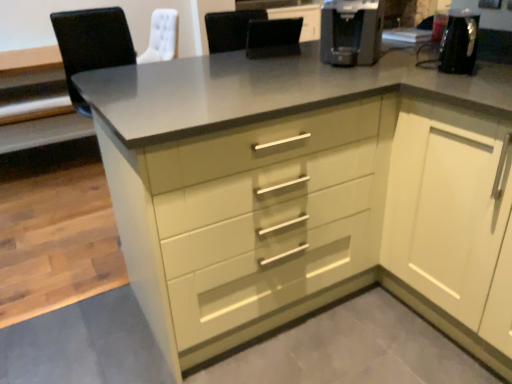
At what (x,y) coordinates should I click in order to perform the action: click on white glossy cabinet at right. Please return your answer as a coordinate pair (x, y). Looking at the image, I should click on pyautogui.click(x=453, y=214).

What do you see at coordinates (273, 38) in the screenshot?
I see `black leather chair at center` at bounding box center [273, 38].

Where is `black plastic coffee machine at upper right`? The width and height of the screenshot is (512, 384). black plastic coffee machine at upper right is located at coordinates (351, 32).

Is the surface of white glossy cabinet at right in direct contact with black leather chair at center?

No.

Considering the relative sizes of white glossy cabinet at right and black leather chair at center in the image provided, is white glossy cabinet at right thinner than black leather chair at center?

Incorrect, the width of white glossy cabinet at right is not less than that of black leather chair at center.

Can you confirm if white glossy cabinet at right is taller than black leather chair at center?

Yes, white glossy cabinet at right is taller than black leather chair at center.

At what (x,y) coordinates should I click in order to perform the action: click on chair below the black plastic coffee machine at upper right (from a real-world perspective). Please return your answer as a coordinate pair (x, y). Looking at the image, I should click on (273, 38).

Is black leather chair at center touching black plastic coffee machine at upper right?

No.

Is black leather chair at center not within black plastic coffee machine at upper right?

Yes, black leather chair at center is outside of black plastic coffee machine at upper right.

Considering the relative sizes of black leather chair at center and black plastic coffee machine at upper right in the image provided, is black leather chair at center thinner than black plastic coffee machine at upper right?

Indeed, black leather chair at center has a lesser width compared to black plastic coffee machine at upper right.

From a real-world perspective, relative to black plastic coffee machine at upper right, is white glossy cabinet at right vertically above or below?

In terms of real-world spatial position, white glossy cabinet at right is below black plastic coffee machine at upper right.

Which object is wider, white glossy cabinet at right or black plastic coffee machine at upper right?

With larger width is white glossy cabinet at right.

Are white glossy cabinet at right and black plastic coffee machine at upper right making contact?

No, white glossy cabinet at right is not touching black plastic coffee machine at upper right.

From a real-world perspective, which is physically below, black plastic coffee machine at upper right or white glossy cabinet at right?

white glossy cabinet at right.

How much distance is there between black plastic coffee machine at upper right and white glossy cabinet at right?

black plastic coffee machine at upper right and white glossy cabinet at right are 23.40 inches apart.

Can you confirm if black plastic coffee machine at upper right is thinner than white glossy cabinet at right?

Yes.

Does black plastic coffee machine at upper right appear on the right side of white glossy cabinet at right?

In fact, black plastic coffee machine at upper right is to the left of white glossy cabinet at right.

From a real-world perspective, is black leather chair at center located higher than white glossy cabinet at right?

Correct, in the physical world, black leather chair at center is higher than white glossy cabinet at right.

Which is less distant, (249, 24) or (420, 129)?

The point (420, 129) is closer.

Is black leather chair at center situated inside white glossy cabinet at right or outside?

black leather chair at center is not enclosed by white glossy cabinet at right.

In terms of width, does black leather chair at center look wider or thinner when compared to white glossy cabinet at right?

Clearly, black leather chair at center has less width compared to white glossy cabinet at right.

Can you confirm if black plastic coffee machine at upper right is wider than black leather chair at center?

Yes, black plastic coffee machine at upper right is wider than black leather chair at center.

Identify the location of coffee machine in front of the black leather chair at center. (351, 32).

Identify the location of chair above the white glossy cabinet at right (from a real-world perspective). The image size is (512, 384). (273, 38).

Where is `coffee machine below the black leather chair at center (from the image's perspective)`? coffee machine below the black leather chair at center (from the image's perspective) is located at coordinates (351, 32).

Which object lies further to the anchor point white glossy cabinet at right, black plastic coffee machine at upper right or black leather chair at center?

Based on the image, black leather chair at center appears to be further to white glossy cabinet at right.

Considering their positions, is white glossy cabinet at right positioned further to black plastic coffee machine at upper right than black leather chair at center?

white glossy cabinet at right is positioned further to the anchor black plastic coffee machine at upper right.

From the image, which object appears to be farther from black leather chair at center, black plastic coffee machine at upper right or white glossy cabinet at right?

white glossy cabinet at right lies further to black leather chair at center than the other object.

Based on their spatial positions, is black leather chair at center or white glossy cabinet at right further from black plastic coffee machine at upper right?

Among the two, white glossy cabinet at right is located further to black plastic coffee machine at upper right.

Which object lies nearer to the anchor point white glossy cabinet at right, black leather chair at center or black plastic coffee machine at upper right?

black plastic coffee machine at upper right lies closer to white glossy cabinet at right than the other object.

Looking at the image, which one is located closer to black leather chair at center, white glossy cabinet at right or black plastic coffee machine at upper right?

The object closer to black leather chair at center is black plastic coffee machine at upper right.

Find the location of a particular element. The image size is (512, 384). coffee machine between black leather chair at center and white glossy cabinet at right in the up-down direction is located at coordinates (351, 32).